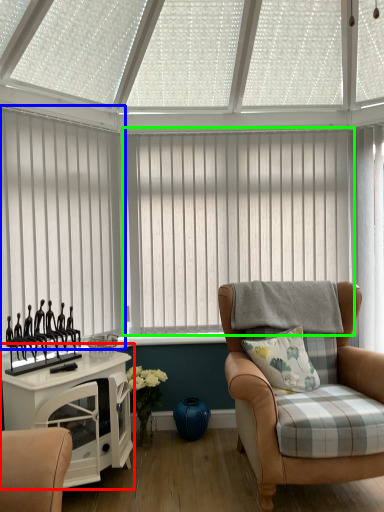
Question: Based on their relative distances, which object is nearer to table (highlighted by a red box)? Choose from window blind (highlighted by a blue box) and window blind (highlighted by a green box).

Choices:
 (A) window blind
 (B) window blind

Answer: (A)